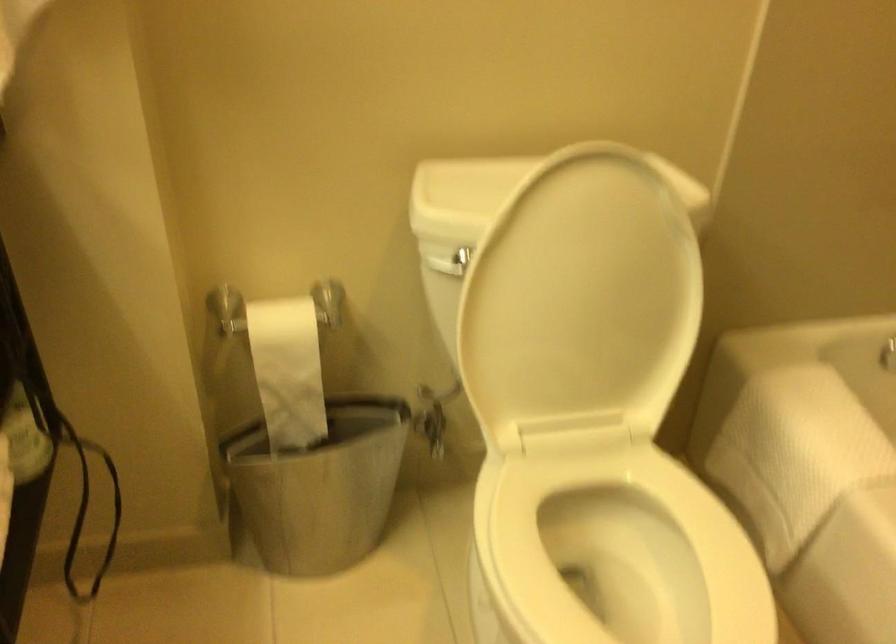
What do you see at coordinates (460, 260) in the screenshot? I see `the silver flush handle` at bounding box center [460, 260].